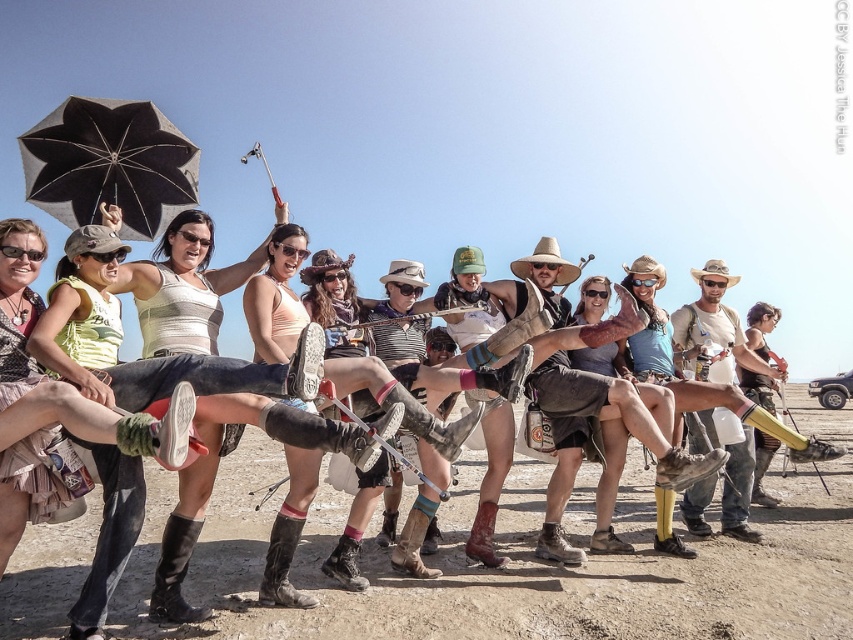
Is matte black boots at center smaller than black leather cowboy boot at lower left?

Incorrect, matte black boots at center is not smaller in size than black leather cowboy boot at lower left.

Can you confirm if matte black boots at center is taller than black leather cowboy boot at lower left?

Yes, matte black boots at center is taller than black leather cowboy boot at lower left.

Image resolution: width=853 pixels, height=640 pixels. In order to click on matte black boots at center in this screenshot , I will do `click(146, 356)`.

Between black leather cowboy boot at lower left and matte black cowboy hat at right, which one is positioned lower?

black leather cowboy boot at lower left is lower down.

Between point (171, 552) and point (759, 381), which one is positioned in front?

Point (171, 552) is in front.

Where is `black leather cowboy boot at lower left`? black leather cowboy boot at lower left is located at coordinates (175, 572).

Who is shorter, dusty brown dirt at center or matte black cowboy hat at right?

matte black cowboy hat at right is shorter.

Which is above, dusty brown dirt at center or matte black cowboy hat at right?

matte black cowboy hat at right is above.

Which is behind, point (515, 580) or point (758, 458)?

Point (758, 458)

I want to click on dusty brown dirt at center, so click(519, 563).